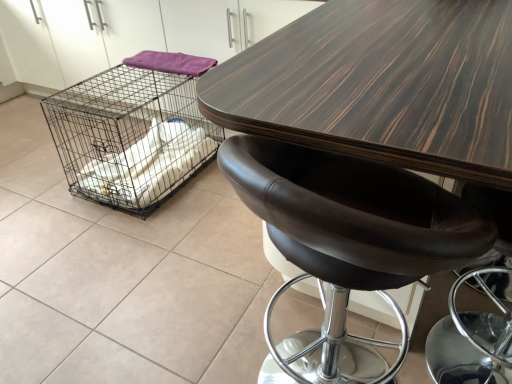
Question: In terms of width, does dark wood table at center look wider or thinner when compared to purple fabric at upper left?

Choices:
 (A) thin
 (B) wide

Answer: (B)

Question: From the image's perspective, relative to purple fabric at upper left, is dark wood table at center above or below?

Choices:
 (A) above
 (B) below

Answer: (A)

Question: Which of these objects is positioned farthest from the purple fabric at upper left?

Choices:
 (A) brown leather stool at center
 (B) dark wood table at center
 (C) black wire mesh cage at left

Answer: (A)

Question: Based on their relative distances, which object is farther from the purple fabric at upper left?

Choices:
 (A) black wire mesh cage at left
 (B) dark wood table at center
 (C) brown leather stool at center

Answer: (C)